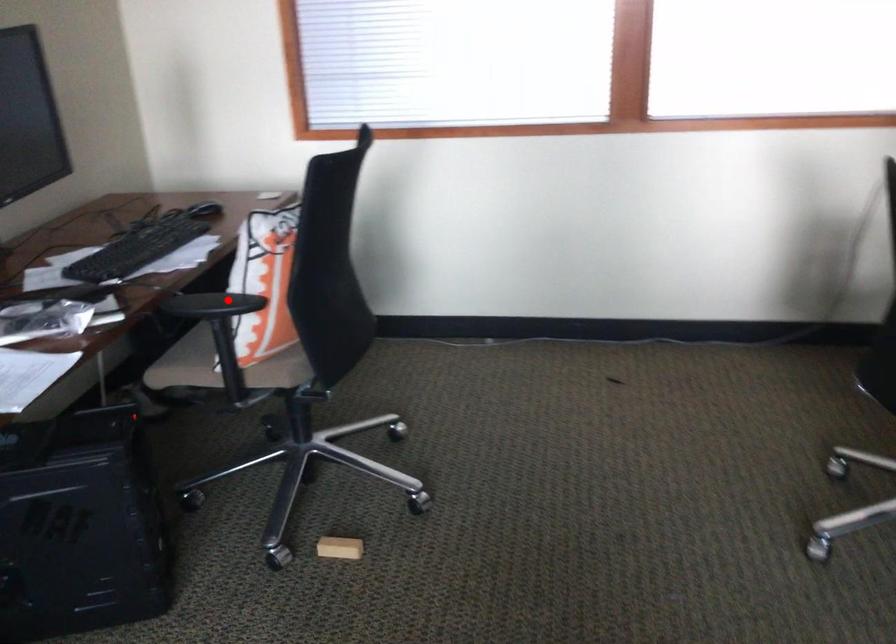
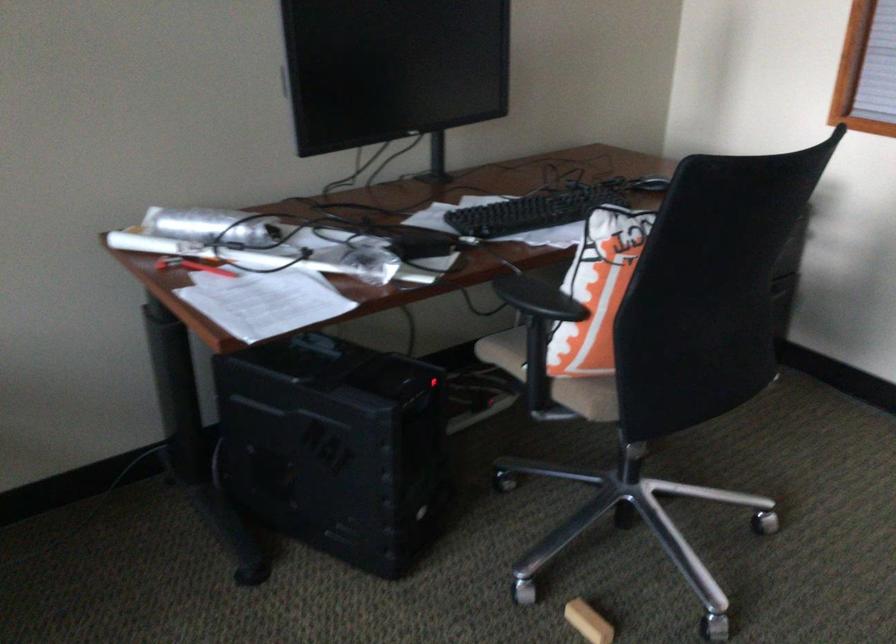
Question: I am providing you with two images of the same scene from different viewpoints. Image1 has a red point marked. In image2, the corresponding 3D location appears at what relative position? Reply with the corresponding letter.

Choices:
 (A) Closer
 (B) Farther

Answer: (A)